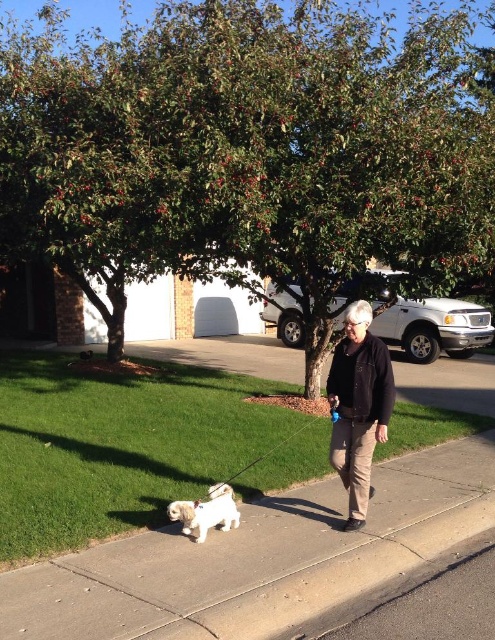
Question: Which point is farther to the camera?

Choices:
 (A) white fluffy dog at lower left
 (B) smooth concrete sidewalk at center

Answer: (A)

Question: From the image, what is the correct spatial relationship of black matte jacket at center in relation to white fluffy dog at lower left?

Choices:
 (A) below
 (B) above

Answer: (B)

Question: Which point is closer to the camera taking this photo?

Choices:
 (A) (122, 570)
 (B) (142, 196)

Answer: (A)

Question: Can you confirm if smooth concrete sidewalk at center is thinner than white fluffy dog at lower left?

Choices:
 (A) no
 (B) yes

Answer: (A)

Question: Which point appears farthest from the camera in this image?

Choices:
 (A) (349, 426)
 (B) (308, 392)
 (C) (215, 506)

Answer: (B)

Question: Is green leafy tree at upper center to the left of white fluffy dog at lower left from the viewer's perspective?

Choices:
 (A) no
 (B) yes

Answer: (B)